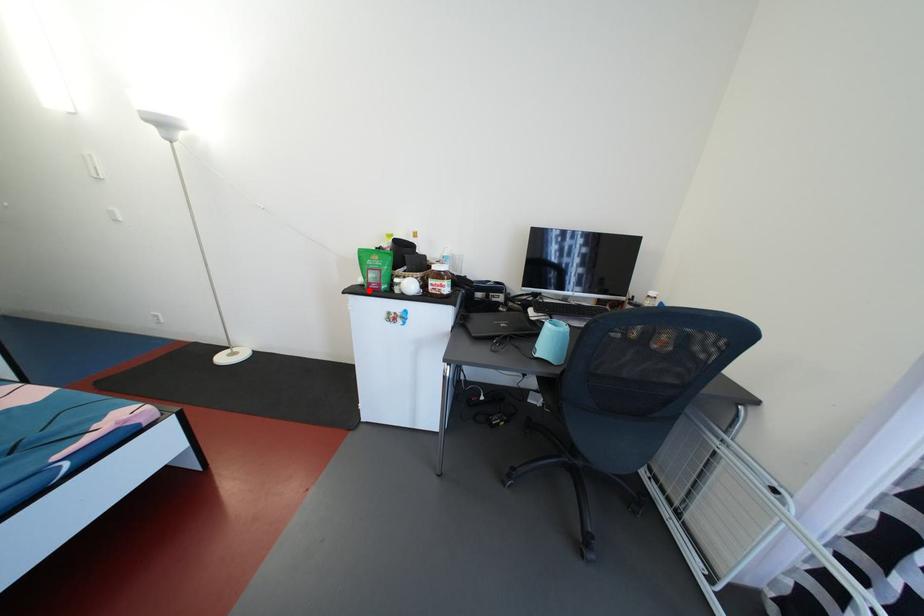
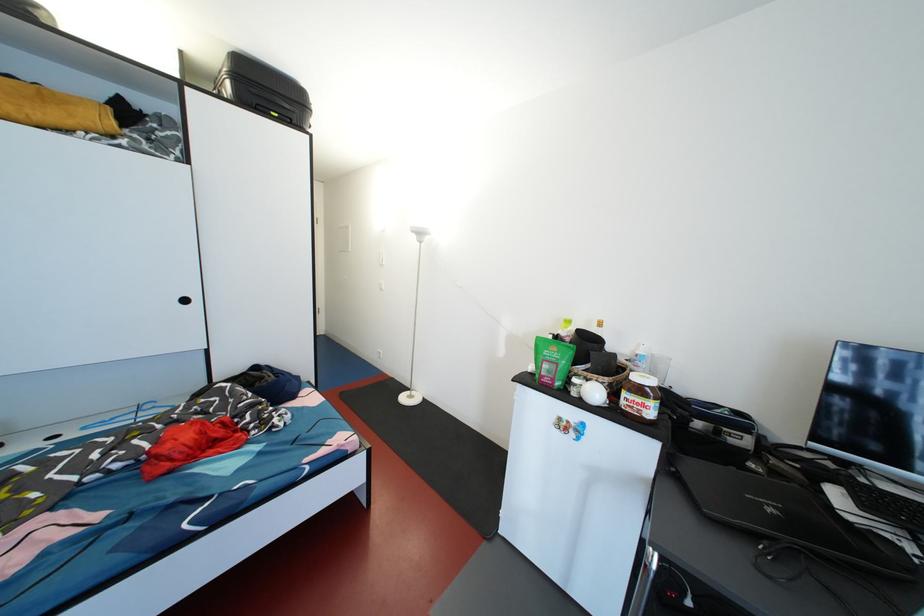
In the second image, find the point that corresponds to the highlighted location in the first image.

(539, 379)